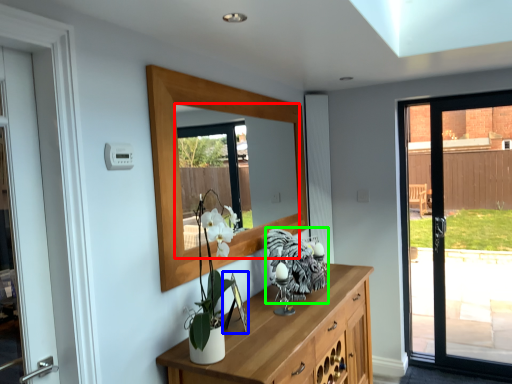
Question: Estimate the real-world distances between objects in this image. Which object is closer to mirror (highlighted by a red box), picture frame (highlighted by a blue box) or animal (highlighted by a green box)?

Choices:
 (A) picture frame
 (B) animal

Answer: (B)